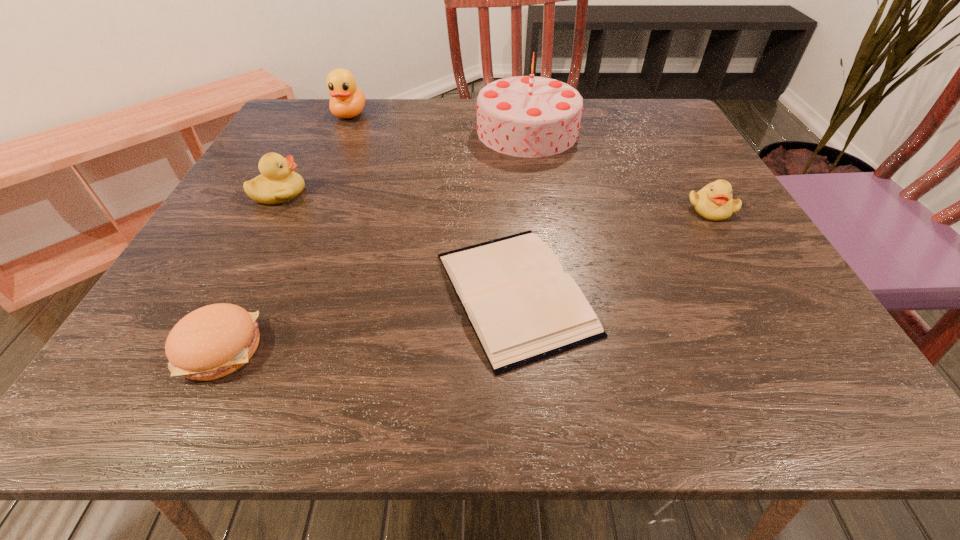
Identify the location of object located in the far left corner section of the desktop. (347, 101).

Find the location of `object at the near left corner`. object at the near left corner is located at coordinates (213, 341).

In the image, there is a desktop. What are the coordinates of `free space at the far edge` in the screenshot? It's located at (598, 139).

Identify the location of free spot at the left edge of the desktop. This screenshot has width=960, height=540. (241, 184).

Where is `free location at the right edge of the desktop`? This screenshot has height=540, width=960. free location at the right edge of the desktop is located at coordinates (731, 239).

Find the location of a particular element. Image resolution: width=960 pixels, height=540 pixels. free region at the far left corner of the desktop is located at coordinates (299, 107).

In the image, there is a desktop. Identify the location of vacant space at the near left corner. Image resolution: width=960 pixels, height=540 pixels. (138, 392).

At what (x,y) coordinates should I click in order to perform the action: click on vacant space that's between the third shortest object and the farthest duckling. Please return your answer as a coordinate pair (x, y). This screenshot has height=540, width=960. Looking at the image, I should click on (530, 161).

Where is `empty location between the rightmost object and the birthday cake`? This screenshot has height=540, width=960. empty location between the rightmost object and the birthday cake is located at coordinates (619, 170).

At what (x,y) coordinates should I click in order to perform the action: click on vacant space in between the tallest object and the hardback book. Please return your answer as a coordinate pair (x, y). Looking at the image, I should click on (521, 212).